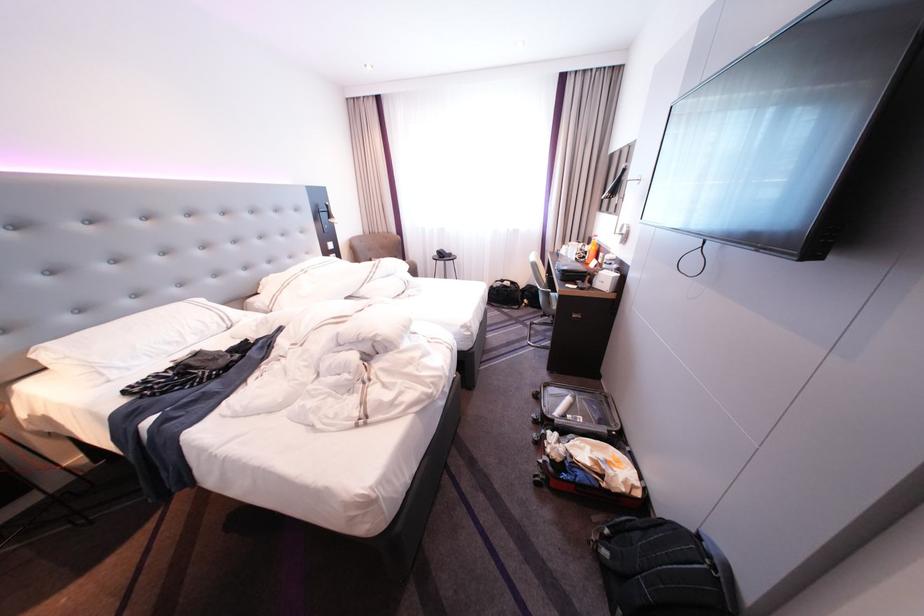
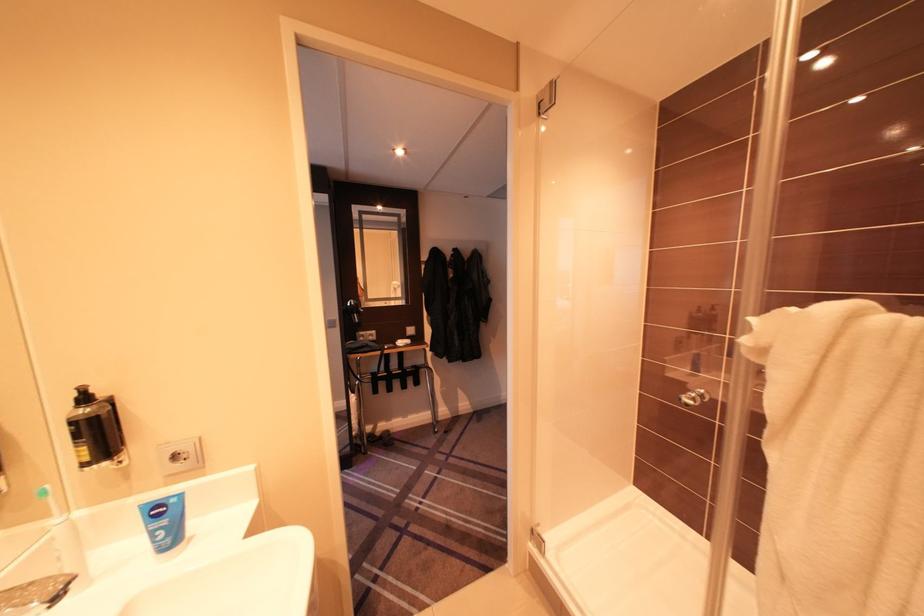
Question: I am providing you with two images of the same scene from different viewpoints. After the viewpoint changes to image2, which objects are now occluded?

Choices:
 (A) black travel bag
 (B) chrome shower knob
 (C) green toothbrush
 (D) brown vase

Answer: (A)